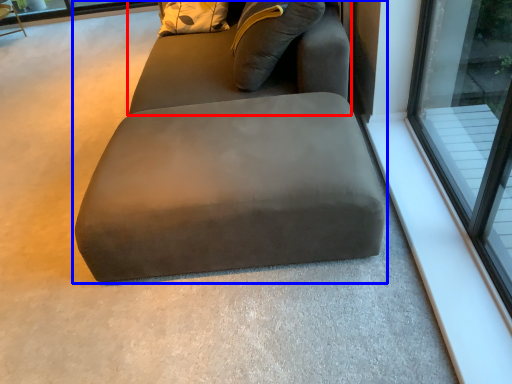
Question: Among these objects, which one is farthest to the camera, bean bag chair (highlighted by a red box) or studio couch (highlighted by a blue box)?

Choices:
 (A) bean bag chair
 (B) studio couch

Answer: (A)